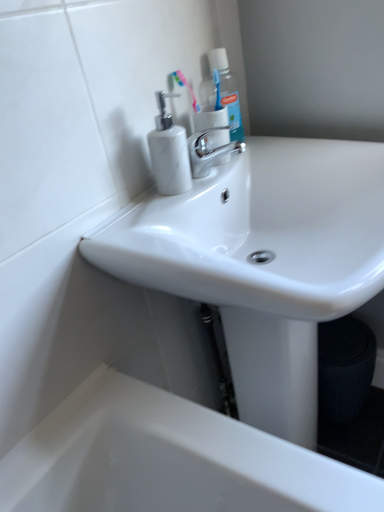
Find the location of a particular element. free space on the front side of white glossy toilet paper at upper center is located at coordinates (187, 189).